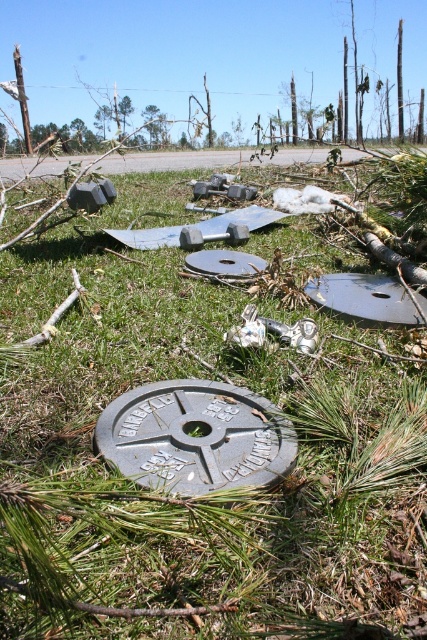
You are a construction worker assessing the damage after a storm. You need to replace the black rubber manhole cover at center and the gray metallic manhole cover at center. Which one requires a wider replacement piece?

The black rubber manhole cover at center requires a wider replacement piece because its width surpasses that of the gray metallic manhole cover at center.

You are a construction worker inspecting the damaged area and need to locate both the black rubber manhole cover at center and the gray metallic manhole cover at center. According to your observations, which one is located to the right of the other?

The black rubber manhole cover at center is positioned on the right side of gray metallic manhole cover at center.